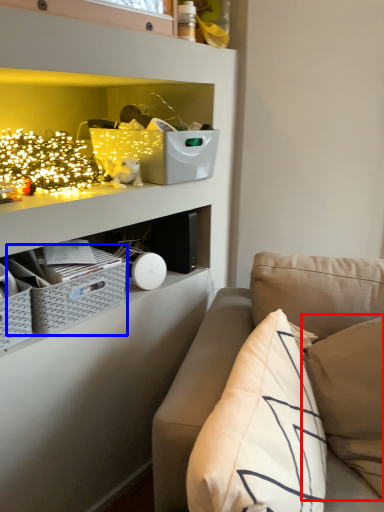
Question: Which object is further to the camera taking this photo, pillow (highlighted by a red box) or crate (highlighted by a blue box)?

Choices:
 (A) pillow
 (B) crate

Answer: (B)